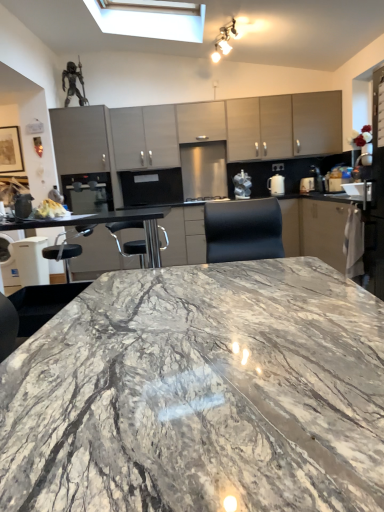
Where is `free space above white glossy light fixture at upper center (from a real-world perspective)`? free space above white glossy light fixture at upper center (from a real-world perspective) is located at coordinates coord(222,27).